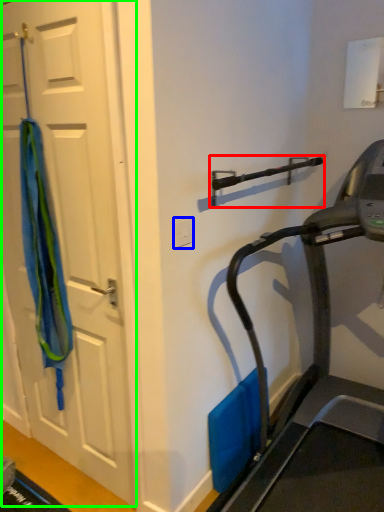
Question: Which object is positioned closest to door handle (highlighted by a red box)? Select from electric outlet (highlighted by a blue box) and door (highlighted by a green box).

Choices:
 (A) electric outlet
 (B) door

Answer: (A)